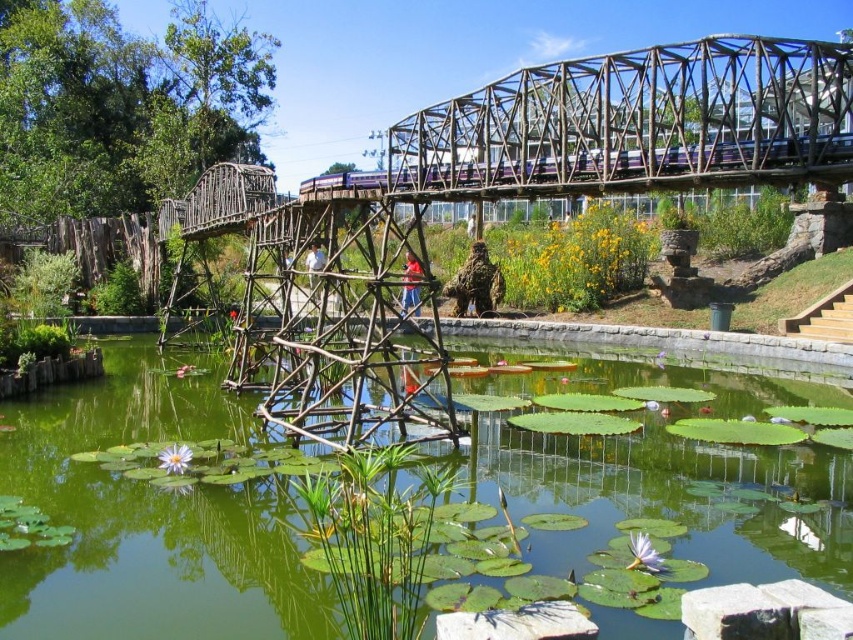
You are designing a new decorative pathway that needs to be wider than the green lily pads at center. Can the metallic structure at upper center serve as a reference for the pathway width? Please explain using the objects mentioned.

Yes, the metallic structure at upper center can serve as a reference because the green lily pads at center are narrower than the metallic structure at upper center, so the pathway can be designed to match the metallic structure at upper center width to ensure it is wider than the lily pads.

You are a painter standing on the wooden bridge and want to paint the green lily pads at center and the metallic structure at upper center. Which object will appear taller in your painting?

The metallic structure at upper center will appear taller in your painting since it has a greater height compared to the green lily pads at center.

You are a painter standing on the wooden bridge and want to paint the green lily pads at center and the metallic structure at upper center. Which object should you look to your left to paint first?

The green lily pads at center is positioned on the left side of metallic structure at upper center, so you should look to your left to paint the green lily pads at center first before the metallic structure at upper center.